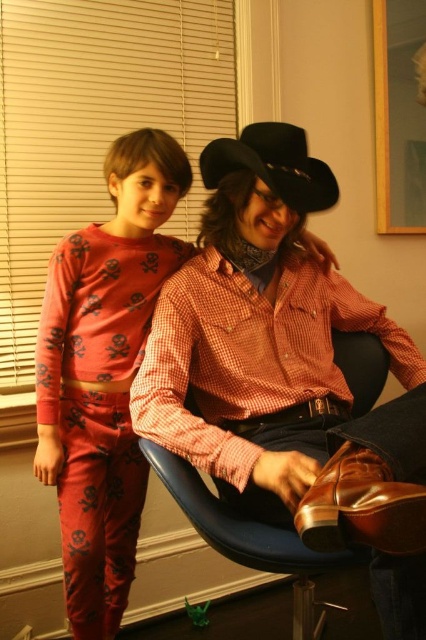
Question: Which object is closer to the camera taking this photo?

Choices:
 (A) black felt fedora at upper center
 (B) matte red pajamas at left
 (C) blue plastic swivel chair at center

Answer: (C)

Question: Is matte red pajamas at left bigger than blue plastic swivel chair at center?

Choices:
 (A) yes
 (B) no

Answer: (B)

Question: Which object appears farthest from the camera in this image?

Choices:
 (A) blue plastic swivel chair at center
 (B) matte red pajamas at left

Answer: (B)

Question: Does matte red pajamas at left have a smaller size compared to blue plastic swivel chair at center?

Choices:
 (A) no
 (B) yes

Answer: (B)

Question: Is matte red pajamas at left above blue plastic swivel chair at center?

Choices:
 (A) yes
 (B) no

Answer: (A)

Question: Which point is closer to the camera taking this photo?

Choices:
 (A) coord(304,188)
 (B) coord(354,387)

Answer: (A)